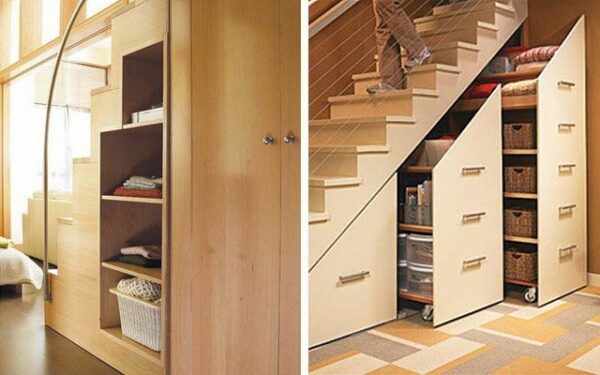
Locate an element on the screen. This screenshot has height=375, width=600. compartments is located at coordinates (135, 151), (136, 227), (111, 309).